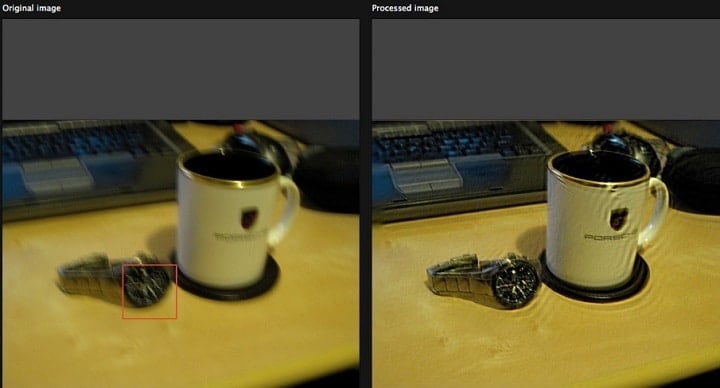
At what (x,y) coordinates should I click in order to perform the action: click on edge of desk. Please return your answer as a coordinate pair (x, y). This screenshot has width=720, height=388. Looking at the image, I should click on (692, 362), (310, 370).